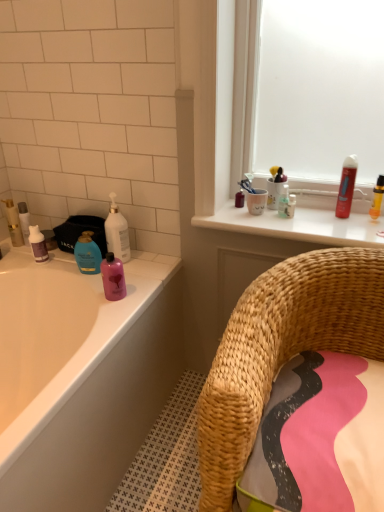
Locate an element on the screen. The image size is (384, 512). vacant space in front of red glossy mouthwash at upper right, the 3th mouthwash ordered from the bottom is located at coordinates (347, 227).